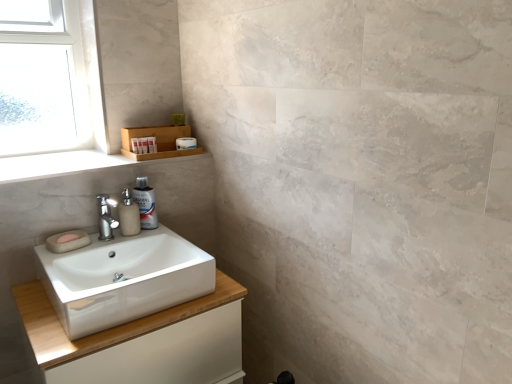
Find the location of `vacant space in front of white matte container at upper left, which is counted as the second toiletry, starting from the back`. vacant space in front of white matte container at upper left, which is counted as the second toiletry, starting from the back is located at coordinates (113, 163).